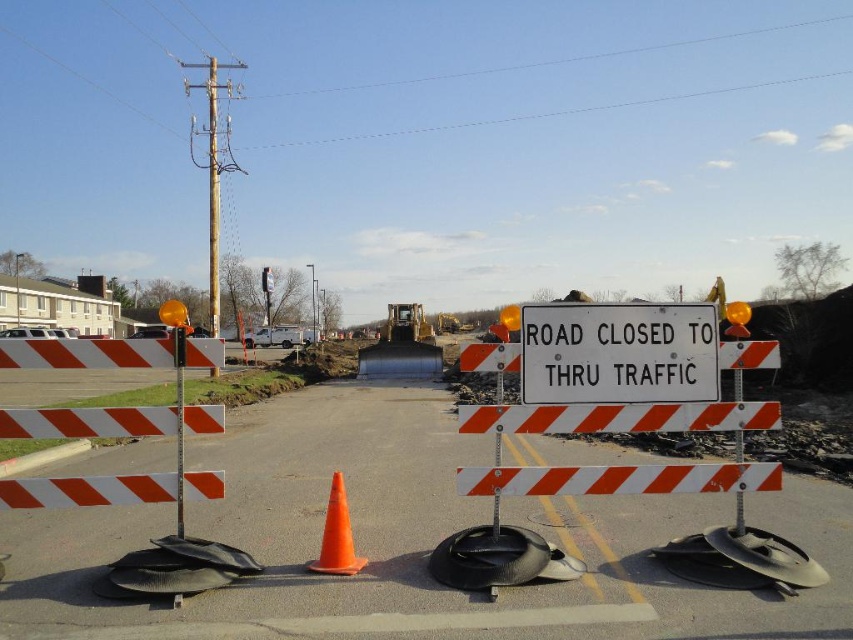
Question: Which object is closer to the camera taking this photo?

Choices:
 (A) white reflective barricade at center
 (B) white plastic sign at center

Answer: (A)

Question: Is white plastic sign at center in front of orange matte/cone at center?

Choices:
 (A) no
 (B) yes

Answer: (B)

Question: Considering the relative positions of white reflective barricade at center and white plastic sign at center in the image provided, where is white reflective barricade at center located with respect to white plastic sign at center?

Choices:
 (A) left
 (B) right

Answer: (A)

Question: Which object appears farthest from the camera in this image?

Choices:
 (A) white reflective barricade at center
 (B) white plastic sign at center

Answer: (B)

Question: Estimate the real-world distances between objects in this image. Which object is closer to the white plastic sign at center?

Choices:
 (A) orange matte/cone at center
 (B) white reflective barricade at center

Answer: (A)

Question: Is white reflective barricade at center bigger than orange matte/cone at center?

Choices:
 (A) no
 (B) yes

Answer: (B)